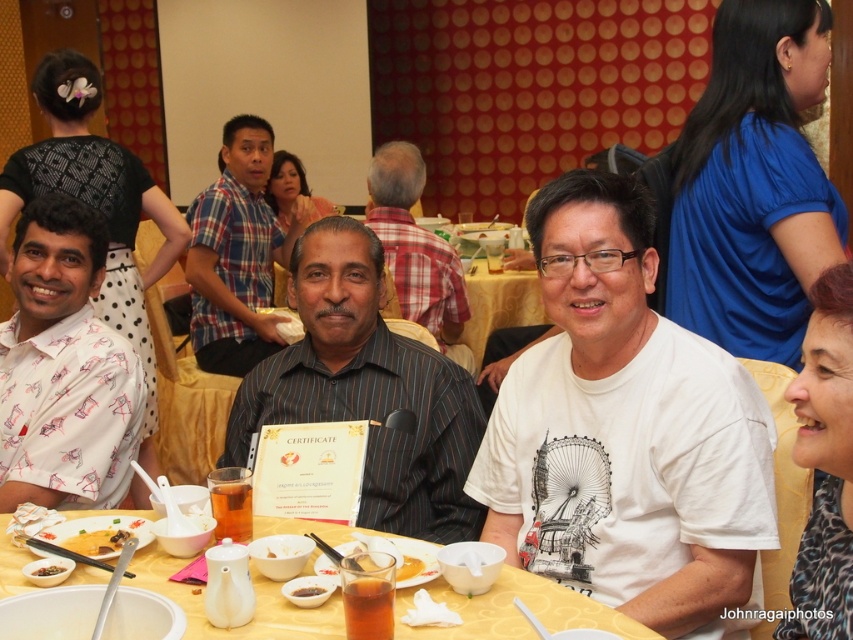
Question: Can you confirm if yellow matte bowl at lower left is wider than yellow matte soup at center?

Choices:
 (A) yes
 (B) no

Answer: (A)

Question: Which point is closer to the camera?

Choices:
 (A) black striped shirt at center
 (B) soy sauce liquid at table center

Answer: (B)

Question: Can you confirm if white printed shirt at left is smaller than soy sauce liquid at table center?

Choices:
 (A) yes
 (B) no

Answer: (B)

Question: Which point is closer to the camera taking this photo?

Choices:
 (A) (93, 544)
 (B) (281, 545)
 (C) (190, 301)

Answer: (B)

Question: Which object is closer to the camera taking this photo?

Choices:
 (A) white matte bowl at center
 (B) black striped shirt at center
 (C) yellow matte soup at center

Answer: (C)

Question: Can you confirm if plaid fabric shirt at center is positioned below black striped shirt at center?

Choices:
 (A) no
 (B) yes

Answer: (A)